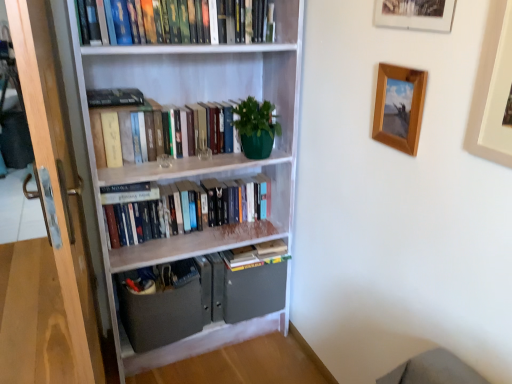
Question: Are hardcover books at center, marked as the 4th book in a top-to-bottom arrangement, and wooden picture frame at upper center, the 2th picture frame when ordered from left to right, making contact?

Choices:
 (A) no
 (B) yes

Answer: (A)

Question: Could wooden picture frame at upper center, the second picture frame viewed from the right, be considered to be inside hardcover books at center, the 1th book positioned from the bottom?

Choices:
 (A) yes
 (B) no

Answer: (B)

Question: Is hardcover books at center, marked as the 4th book in a top-to-bottom arrangement, to the right of wooden picture frame at upper center, the second picture frame viewed from the right, from the viewer's perspective?

Choices:
 (A) yes
 (B) no

Answer: (B)

Question: Is the depth of hardcover books at center, the 1th book positioned from the bottom, greater than that of wooden picture frame at upper center, the second picture frame viewed from the right?

Choices:
 (A) yes
 (B) no

Answer: (A)

Question: From a real-world perspective, is hardcover books at center, marked as the 4th book in a top-to-bottom arrangement, below wooden picture frame at upper center, the 2th picture frame when ordered from left to right?

Choices:
 (A) yes
 (B) no

Answer: (A)

Question: Is hardcover books at center, marked as the 4th book in a top-to-bottom arrangement, oriented away from wooden picture frame at upper center, the 2th picture frame when ordered from left to right?

Choices:
 (A) yes
 (B) no

Answer: (B)

Question: Does white matte bookcase at center have a smaller size compared to wooden picture frame at upper right, arranged as the third picture frame when viewed from the right?

Choices:
 (A) no
 (B) yes

Answer: (A)

Question: From the image's perspective, is white matte bookcase at center beneath wooden picture frame at upper right, placed as the 1th picture frame when sorted from left to right?

Choices:
 (A) yes
 (B) no

Answer: (A)

Question: Is white matte bookcase at center not close to wooden picture frame at upper right, arranged as the third picture frame when viewed from the right?

Choices:
 (A) yes
 (B) no

Answer: (B)

Question: From a real-world perspective, does white matte bookcase at center stand above wooden picture frame at upper right, placed as the 1th picture frame when sorted from left to right?

Choices:
 (A) yes
 (B) no

Answer: (B)

Question: Considering the relative positions of white matte bookcase at center and wooden picture frame at upper right, arranged as the third picture frame when viewed from the right, in the image provided, is white matte bookcase at center to the left of wooden picture frame at upper right, arranged as the third picture frame when viewed from the right, from the viewer's perspective?

Choices:
 (A) no
 (B) yes

Answer: (B)

Question: From a real-world perspective, is white matte bookcase at center positioned under wooden picture frame at upper right, placed as the 1th picture frame when sorted from left to right, based on gravity?

Choices:
 (A) no
 (B) yes

Answer: (B)

Question: Is hardcover books at upper center, which is counted as the first book, starting from the top, at the back of matte gray cabinet at lower center?

Choices:
 (A) no
 (B) yes

Answer: (A)